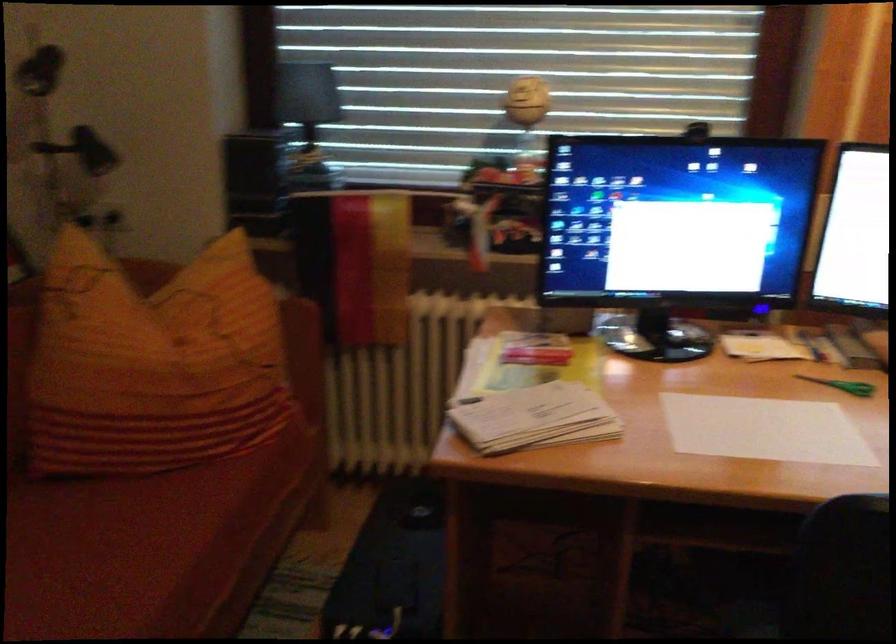
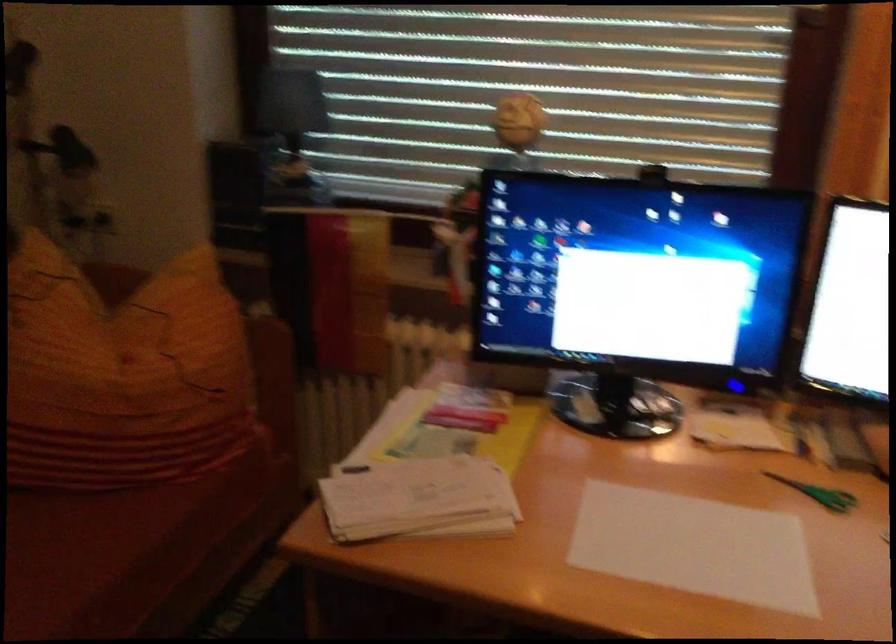
Question: The camera is either moving clockwise (left) or counter-clockwise (right) around the object. The first image is from the beginning of the video and the second image is from the end. Is the camera moving left or right when shooting the video?

Choices:
 (A) Left
 (B) Right

Answer: (B)